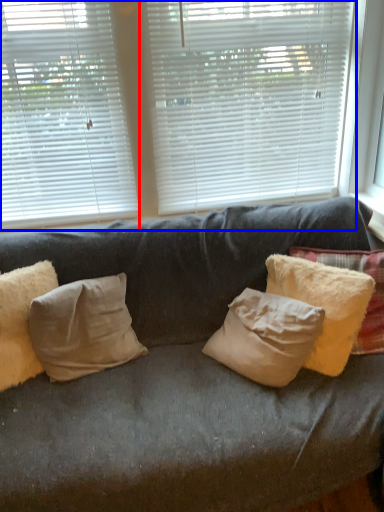
Question: Which object is closer to the camera taking this photo, window blind (highlighted by a red box) or window blind (highlighted by a blue box)?

Choices:
 (A) window blind
 (B) window blind

Answer: (A)